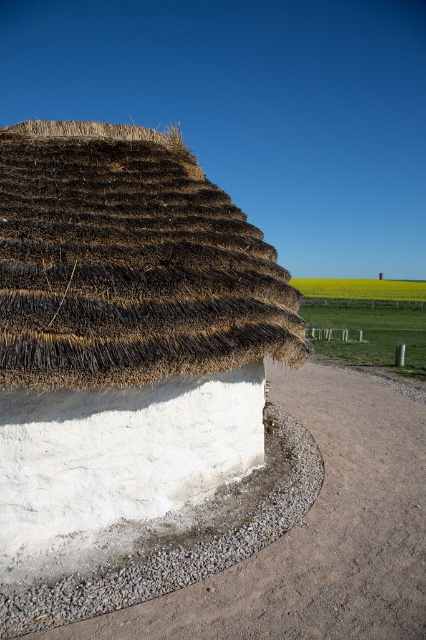
Question: Does thatched straw hut at center appear on the right side of gray gravel at lower center?

Choices:
 (A) yes
 (B) no

Answer: (B)

Question: Which point is closer to the camera?

Choices:
 (A) (215, 531)
 (B) (106, 401)

Answer: (B)

Question: Which object is closer to the camera taking this photo?

Choices:
 (A) thatched straw hut at center
 (B) gray gravel at lower center

Answer: (B)

Question: Does thatched straw hut at center come in front of gray gravel at lower center?

Choices:
 (A) yes
 (B) no

Answer: (B)

Question: Does thatched straw hut at center have a smaller size compared to gray gravel at lower center?

Choices:
 (A) no
 (B) yes

Answer: (A)